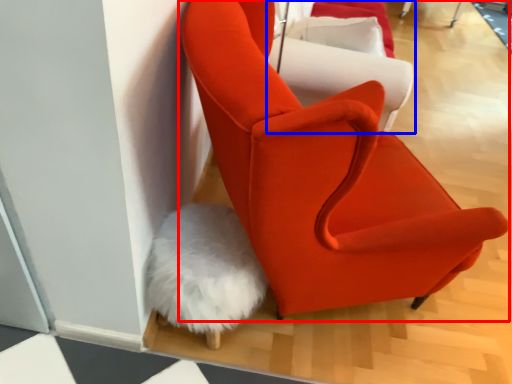
Question: Among these objects, which one is farthest to the camera, chair (highlighted by a red box) or chair (highlighted by a blue box)?

Choices:
 (A) chair
 (B) chair

Answer: (B)